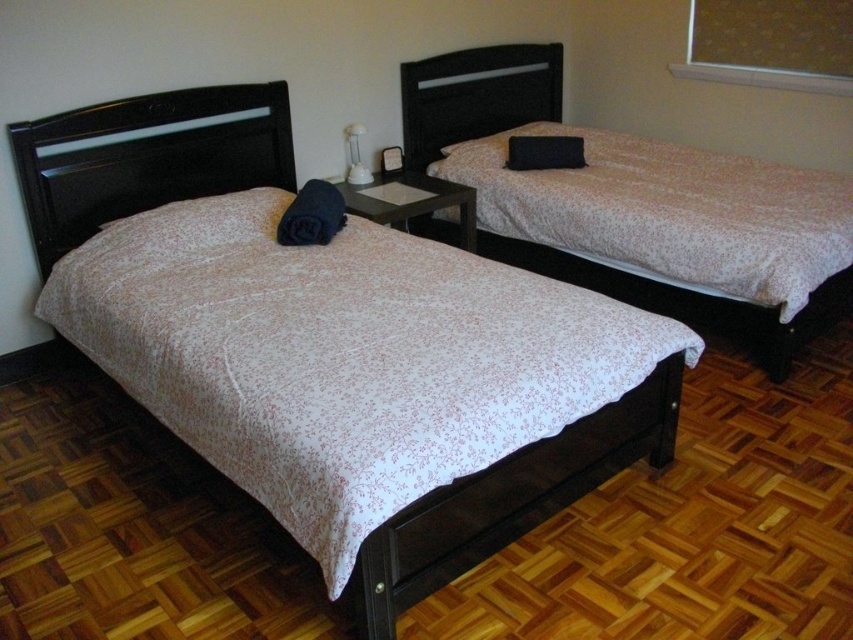
You are standing in the center of the bedroom. The white floral fabric bed at left is located at coordinates 0.248, 0.172. If you want to walk directly to it, in which direction should you move?

Since the white floral fabric bed at left is located at coordinates (x=146, y=157), you should move to the left to reach it.

You are a delivery person who needs to place a package on the tallest object in the bedroom. Which object should you choose between the white floral fabric bed at left and the white glossy lamp at center?

The white floral fabric bed at left is taller than the white glossy lamp at center, so you should place the package on the white floral fabric bed at left.

You are standing in the bedroom and want to place a new nightstand exactly at point (x=146, y=157). Is there already an object at that location?

The white floral fabric bed at left is located at point (x=146, y=157), so there is already an object at that location.